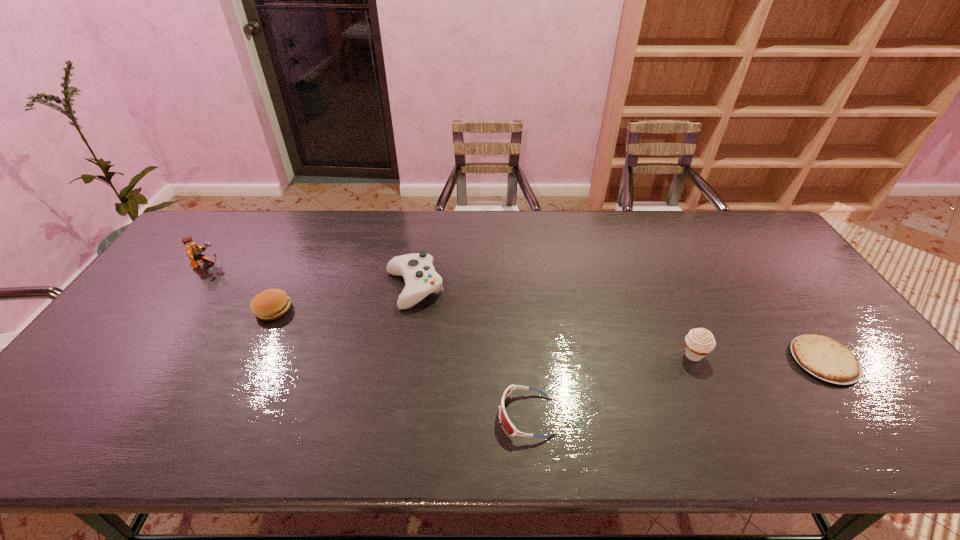
This screenshot has width=960, height=540. What are the coordinates of `vacant space that satisfies the following two spatial constraints: 1. on the front side of the second object from right to left; 2. on the left side of the tortilla` in the screenshot? It's located at (695, 360).

The width and height of the screenshot is (960, 540). Identify the location of vacant space that satisfies the following two spatial constraints: 1. holding a crossbow in the hands of the leftmost object; 2. on the left side of the third tallest object. (192, 288).